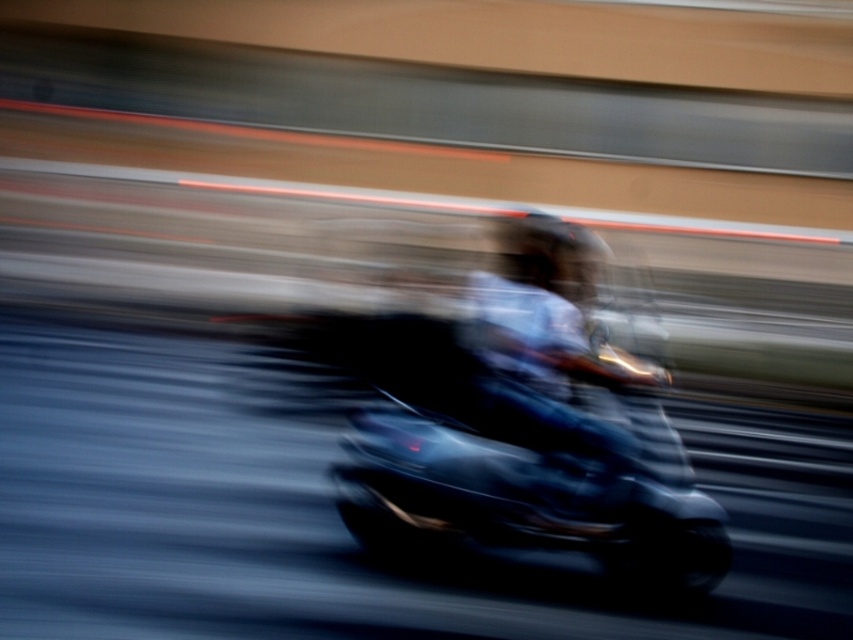
Question: In this image, where is shiny black motorcycle at center located relative to dark blue helmet at center?

Choices:
 (A) right
 (B) left

Answer: (B)

Question: Which of the following is the farthest from the observer?

Choices:
 (A) (602, 369)
 (B) (577, 506)

Answer: (B)

Question: Among these points, which one is nearest to the camera?

Choices:
 (A) (601, 275)
 (B) (345, 472)

Answer: (A)

Question: In this image, where is shiny black motorcycle at center located relative to dark blue helmet at center?

Choices:
 (A) right
 (B) left

Answer: (B)

Question: Is shiny black motorcycle at center above dark blue helmet at center?

Choices:
 (A) no
 (B) yes

Answer: (A)